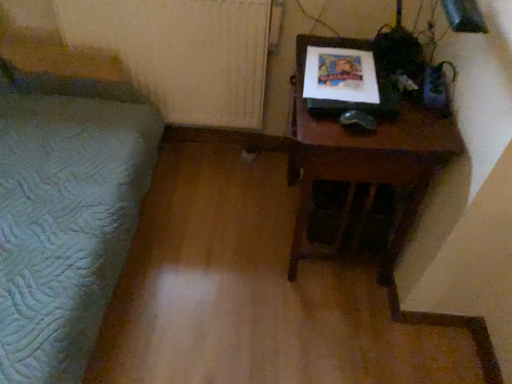
The image size is (512, 384). Find the location of `vacant area situated to the left side of wooden table at right`. vacant area situated to the left side of wooden table at right is located at coordinates (225, 227).